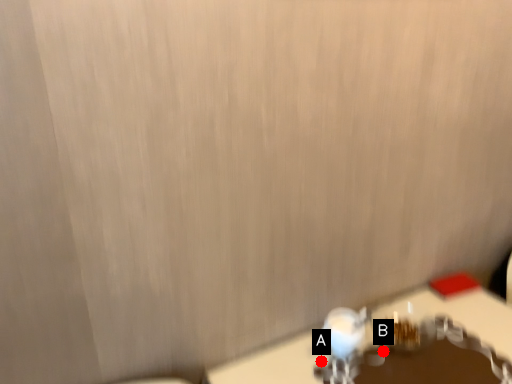
Question: Two points are circled on the image, labeled by A and B beside each circle. Which point is farther from the camera taking this photo?

Choices:
 (A) A is further
 (B) B is further

Answer: (B)